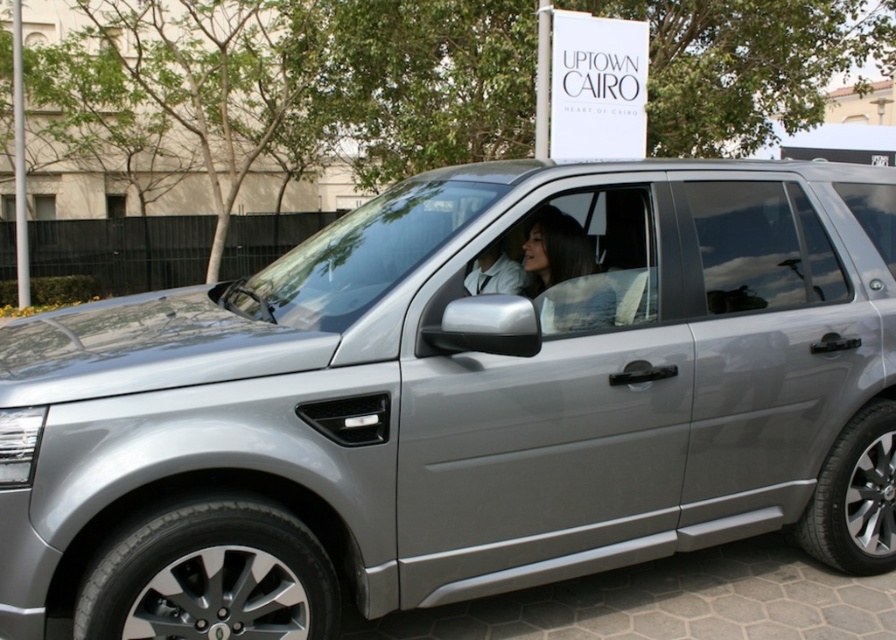
You are a delivery person trying to hand a package to the driver through the transparent glass window at center. Can you see the smooth black hair at center from your position outside the silver Land Rover SUV?

The transparent glass window at center is positioned over the smooth black hair at center, so yes, you can see the smooth black hair at center through the transparent glass window at center.